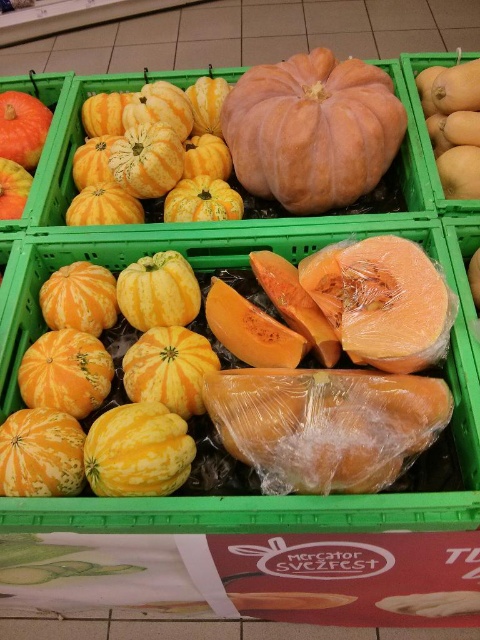
You are a customer in the grocery store looking at the pumpkins and squashes. You see a point marked at coordinates [296,426]. What object is this point located on?

The point at coordinates [296,426] is located on the translucent plastic cantaloupe at center.

You are a customer trying to reach the translucent plastic cantaloupe at center and the orange matte pumpkin at upper left. Which one is taller?

The translucent plastic cantaloupe at center is taller than the orange matte pumpkin at upper left.

You are a customer in the grocery store and want to buy both the translucent plastic cantaloupe at center and the yellow matte pumpkin at center. If you place them side by side in your shopping cart, how much space will they occupy together?

The translucent plastic cantaloupe at center and yellow matte pumpkin at center are 16.08 centimeters apart, so when placed side by side, they will occupy approximately 16.08 centimeters of space combined.